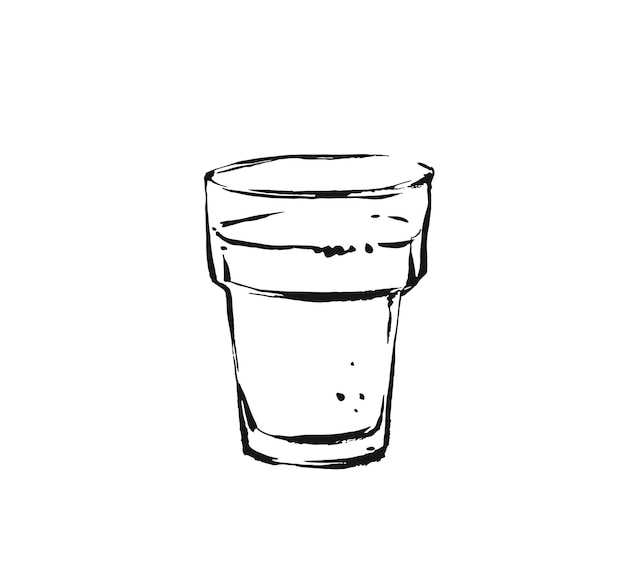
Where is `cup`? Image resolution: width=626 pixels, height=579 pixels. cup is located at coordinates 305,347.